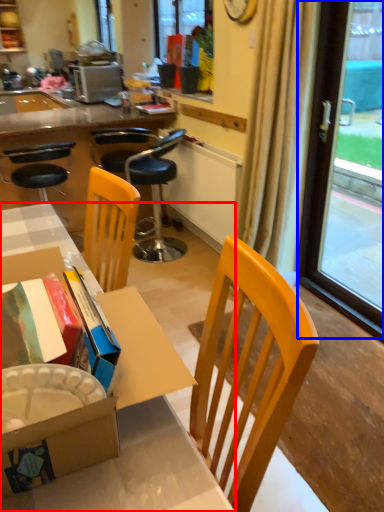
Question: Which object is further to the camera taking this photo, desk (highlighted by a red box) or window screen (highlighted by a blue box)?

Choices:
 (A) desk
 (B) window screen

Answer: (B)